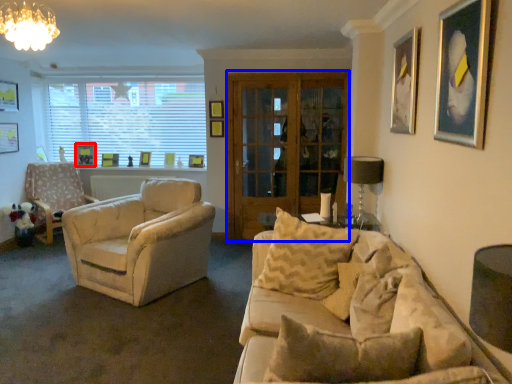
Question: Which object is further to the camera taking this photo, picture frame (highlighted by a red box) or glass door (highlighted by a blue box)?

Choices:
 (A) picture frame
 (B) glass door

Answer: (A)